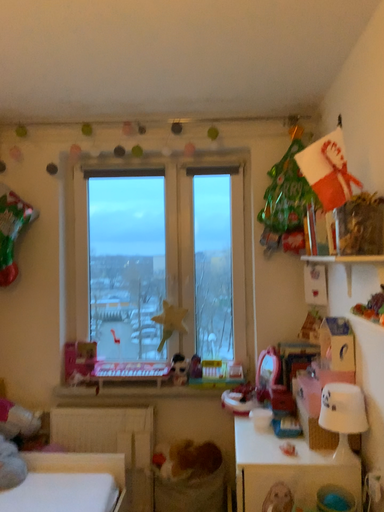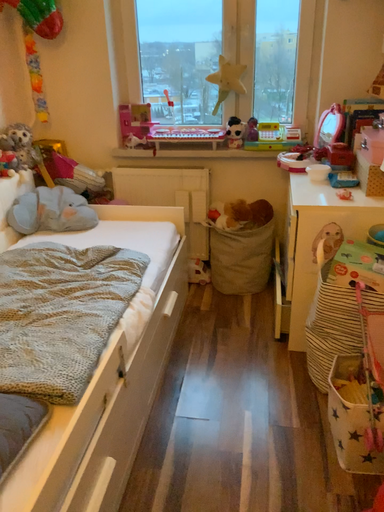
Question: How did the camera likely rotate when shooting the video?

Choices:
 (A) rotated downward
 (B) rotated upward

Answer: (A)